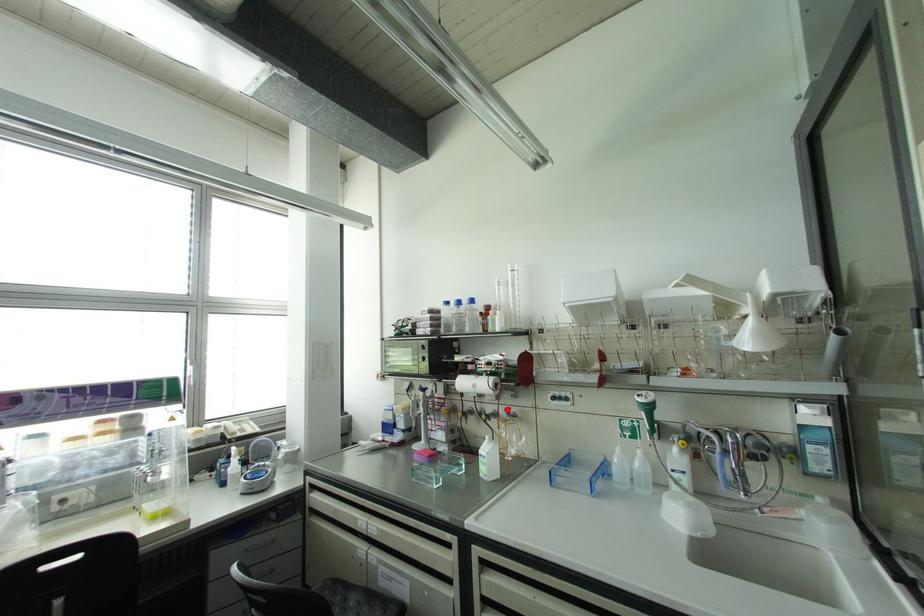
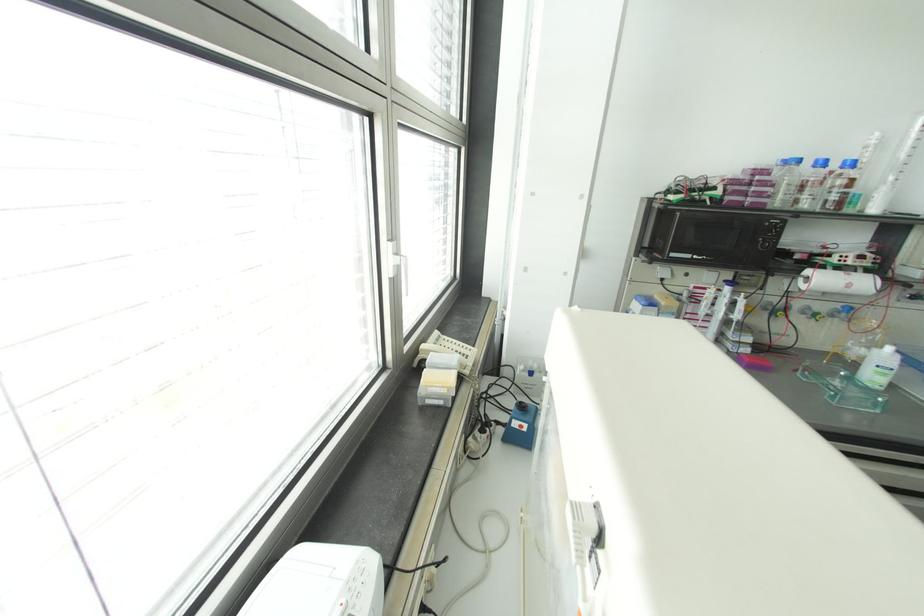
Find the pixel in the second image that matches the highlighted location in the first image.

(848, 309)